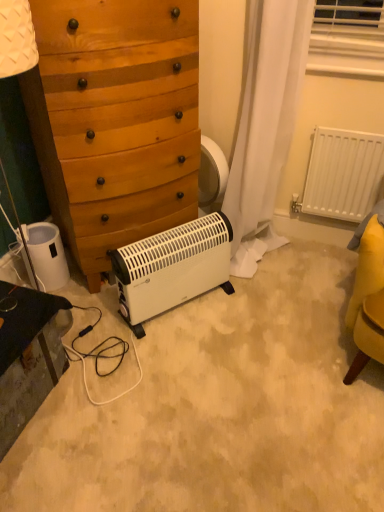
Question: Considering the relative sizes of white plastic radiator at right and white plastic heater at lower left in the image provided, is white plastic radiator at right taller than white plastic heater at lower left?

Choices:
 (A) yes
 (B) no

Answer: (A)

Question: Is white plastic radiator at right outside white plastic heater at lower left?

Choices:
 (A) no
 (B) yes

Answer: (B)

Question: Considering the relative positions of white plastic radiator at right and white plastic heater at lower left in the image provided, is white plastic radiator at right to the right of white plastic heater at lower left from the viewer's perspective?

Choices:
 (A) no
 (B) yes

Answer: (B)

Question: Is white plastic radiator at right far away from white plastic heater at lower left?

Choices:
 (A) yes
 (B) no

Answer: (A)

Question: Does white plastic radiator at right have a larger size compared to white plastic heater at lower left?

Choices:
 (A) no
 (B) yes

Answer: (B)

Question: Based on their positions, is white plastic heater at lower left located to the left or right of black glossy vanity at lower left?

Choices:
 (A) left
 (B) right

Answer: (A)

Question: Would you say white plastic heater at lower left is inside or outside black glossy vanity at lower left?

Choices:
 (A) outside
 (B) inside

Answer: (A)

Question: From a real-world perspective, is white plastic heater at lower left physically located above or below black glossy vanity at lower left?

Choices:
 (A) below
 (B) above

Answer: (B)

Question: From their relative heights in the image, would you say white plastic heater at lower left is taller or shorter than black glossy vanity at lower left?

Choices:
 (A) short
 (B) tall

Answer: (A)

Question: In the image, is white plastic radiator at right on the left side or the right side of black glossy vanity at lower left?

Choices:
 (A) left
 (B) right

Answer: (B)

Question: Looking at the image, does white plastic radiator at right seem bigger or smaller compared to black glossy vanity at lower left?

Choices:
 (A) small
 (B) big

Answer: (A)

Question: From a real-world perspective, relative to black glossy vanity at lower left, is white plastic radiator at right vertically above or below?

Choices:
 (A) below
 (B) above

Answer: (B)

Question: Do you think white plastic radiator at right is within black glossy vanity at lower left, or outside of it?

Choices:
 (A) outside
 (B) inside

Answer: (A)

Question: Considering the relative positions of wooden chest of drawers at center and black glossy vanity at lower left in the image provided, is wooden chest of drawers at center to the left or to the right of black glossy vanity at lower left?

Choices:
 (A) left
 (B) right

Answer: (B)

Question: In terms of height, does wooden chest of drawers at center look taller or shorter compared to black glossy vanity at lower left?

Choices:
 (A) short
 (B) tall

Answer: (B)